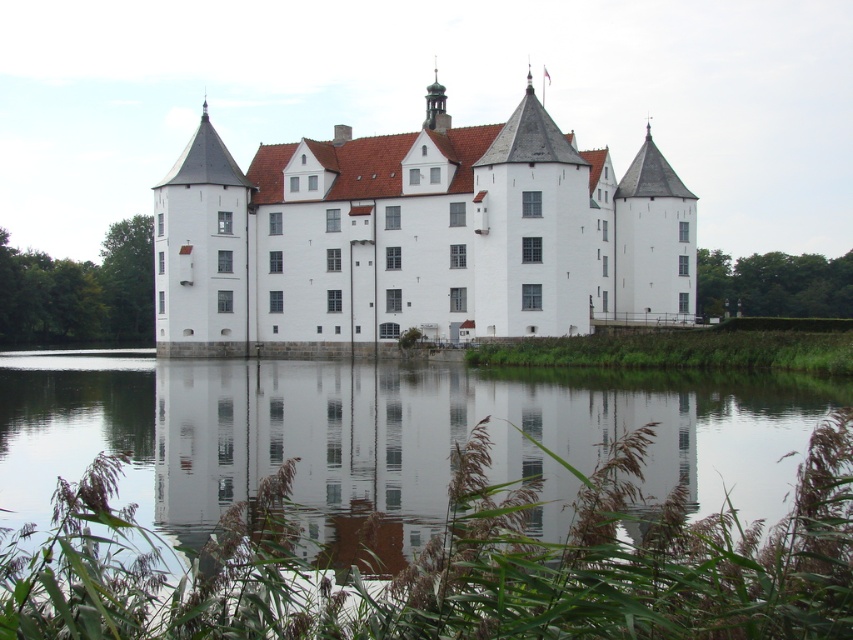
Question: Among these points, which one is nearest to the camera?

Choices:
 (A) (39, 499)
 (B) (595, 307)

Answer: (A)

Question: Among these objects, which one is nearest to the camera?

Choices:
 (A) white stone castle at center
 (B) transparent glass water at center

Answer: (B)

Question: Does transparent glass water at center appear on the left side of white stone castle at center?

Choices:
 (A) no
 (B) yes

Answer: (B)

Question: Does transparent glass water at center appear on the left side of white stone castle at center?

Choices:
 (A) yes
 (B) no

Answer: (A)

Question: Does transparent glass water at center have a larger size compared to white stone castle at center?

Choices:
 (A) yes
 (B) no

Answer: (B)